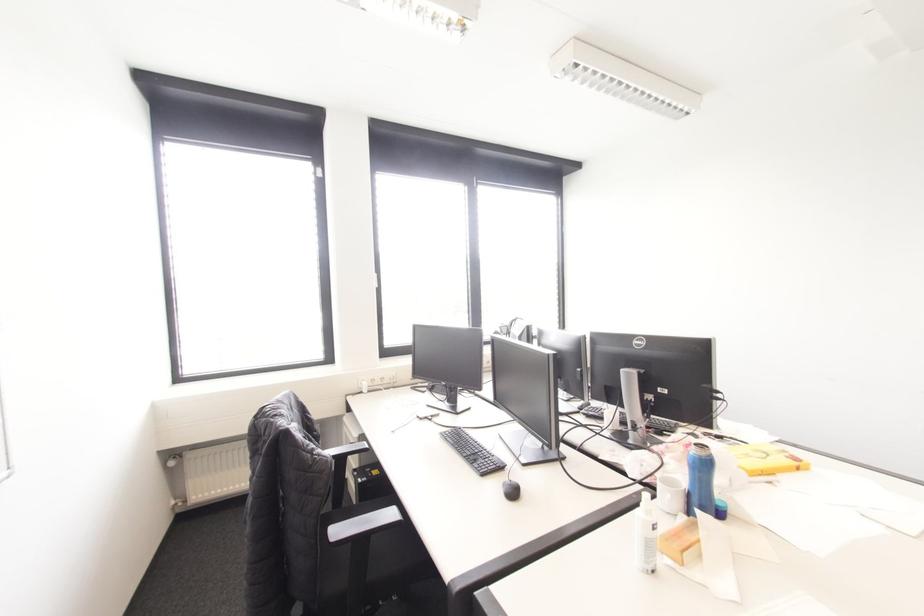
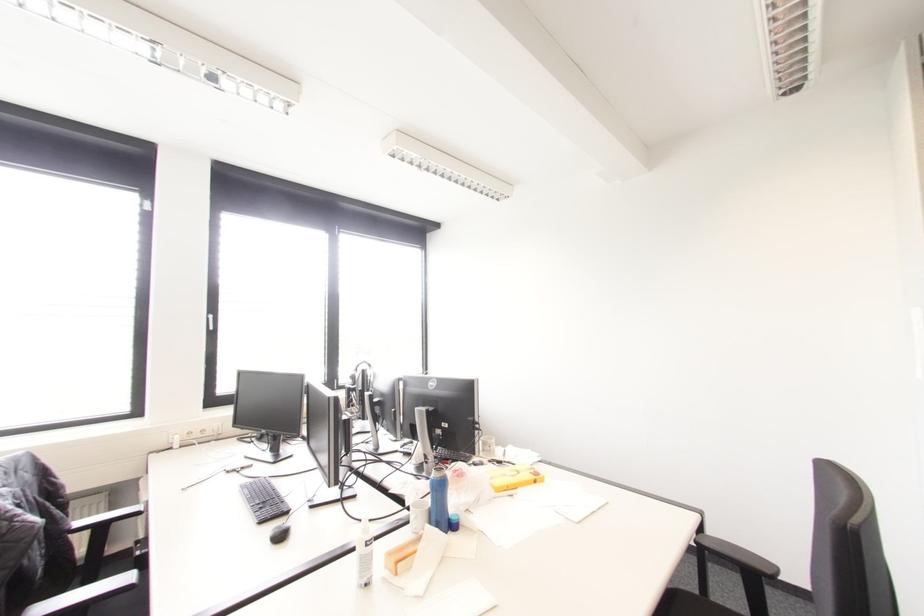
In the second image, find the point that corresponds to point (513, 493) in the first image.

(281, 536)